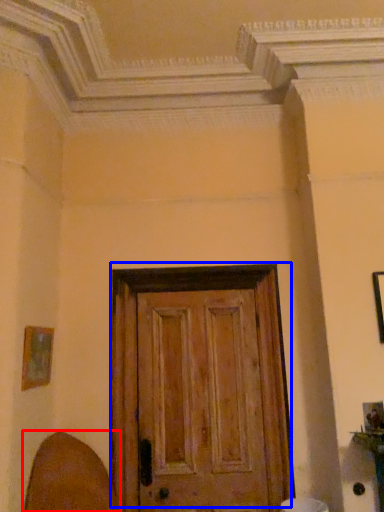
Question: Which object appears closest to the camera in this image, swivel chair (highlighted by a red box) or door (highlighted by a blue box)?

Choices:
 (A) swivel chair
 (B) door

Answer: (A)